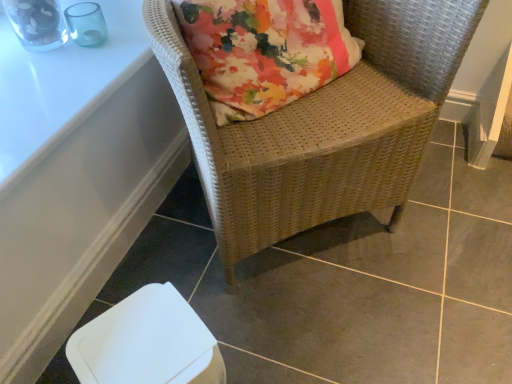
Question: Choose the correct answer: Is white plastic swivel chair at lower left inside white glossy table at upper left, the 2th table when ordered from bottom to top, or outside it?

Choices:
 (A) inside
 (B) outside

Answer: (B)

Question: From a real-world perspective, is white plastic swivel chair at lower left above or below white glossy table at upper left, arranged as the first table when viewed from the top?

Choices:
 (A) below
 (B) above

Answer: (A)

Question: Which object is positioned farthest from the white plastic swivel chair at lower left?

Choices:
 (A) woven wicker chair at upper right
 (B) white glossy table at upper left, arranged as the first table when viewed from the top
 (C) white plastic table at lower left, positioned as the first table in bottom-to-top order

Answer: (B)

Question: Which object is the farthest from the white glossy table at upper left, arranged as the first table when viewed from the top?

Choices:
 (A) white plastic table at lower left, positioned as the first table in bottom-to-top order
 (B) white plastic swivel chair at lower left
 (C) woven wicker chair at upper right

Answer: (B)